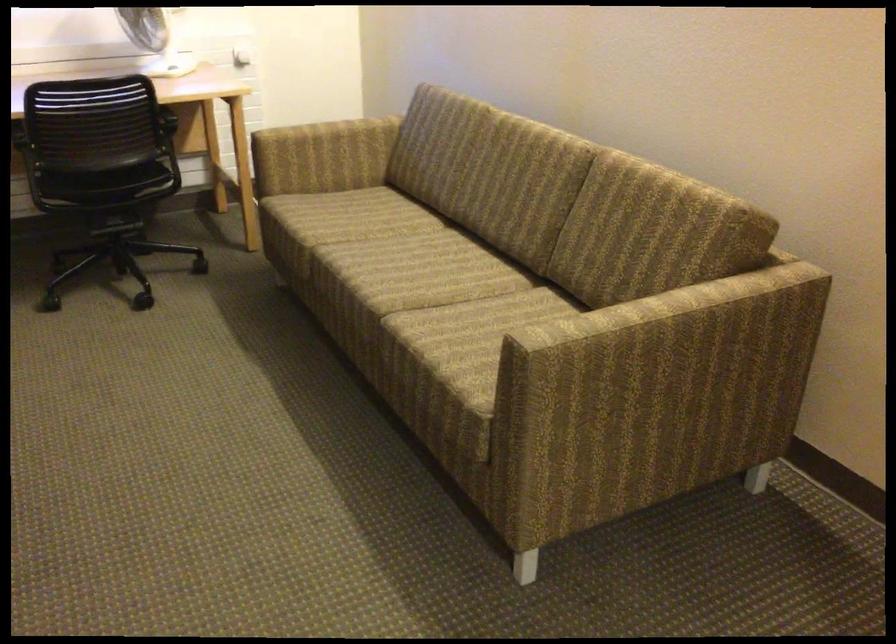
This screenshot has height=644, width=896. What do you see at coordinates (104, 185) in the screenshot? I see `the chair sitting surface` at bounding box center [104, 185].